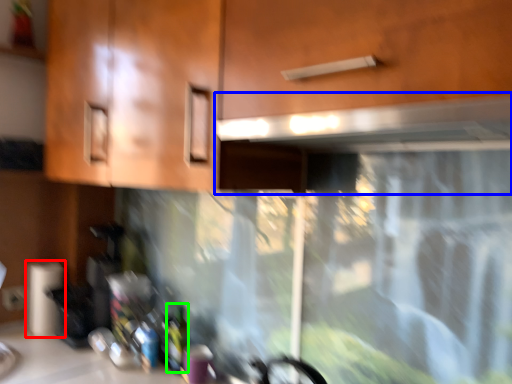
Question: Which object is the farthest from paper towel (highlighted by a red box)? Choose among these: exhaust hood (highlighted by a blue box) or bottle (highlighted by a green box).

Choices:
 (A) exhaust hood
 (B) bottle

Answer: (A)